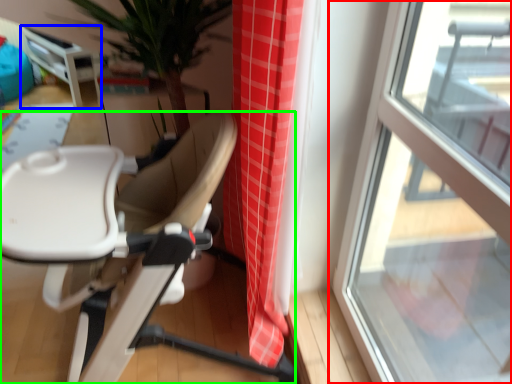
Question: Considering the real-world distances, which object is farthest from window (highlighted by a red box)? table (highlighted by a blue box) or chair (highlighted by a green box)?

Choices:
 (A) table
 (B) chair

Answer: (A)